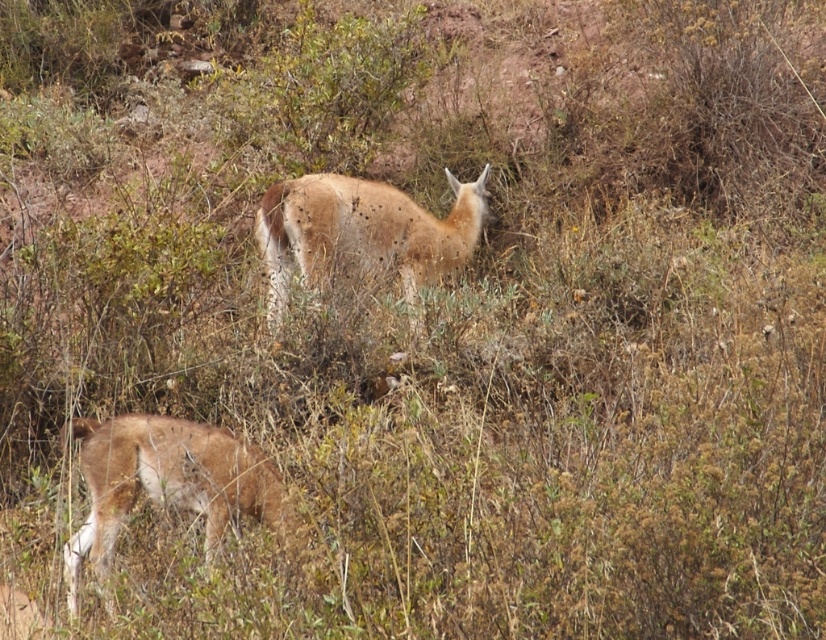
Question: Which of the following is the farthest from the observer?

Choices:
 (A) (197, 472)
 (B) (317, 202)

Answer: (B)

Question: Considering the relative positions of brown furry antelope at lower left and spotted fur antelope at center in the image provided, where is brown furry antelope at lower left located with respect to spotted fur antelope at center?

Choices:
 (A) right
 (B) left

Answer: (B)

Question: Which point is closer to the camera?

Choices:
 (A) brown furry antelope at lower left
 (B) spotted fur antelope at center

Answer: (A)

Question: Can you confirm if brown furry antelope at lower left is positioned below spotted fur antelope at center?

Choices:
 (A) yes
 (B) no

Answer: (A)

Question: Which object is farther from the camera taking this photo?

Choices:
 (A) brown furry antelope at lower left
 (B) spotted fur antelope at center

Answer: (B)

Question: Is brown furry antelope at lower left closer to the viewer compared to spotted fur antelope at center?

Choices:
 (A) yes
 (B) no

Answer: (A)